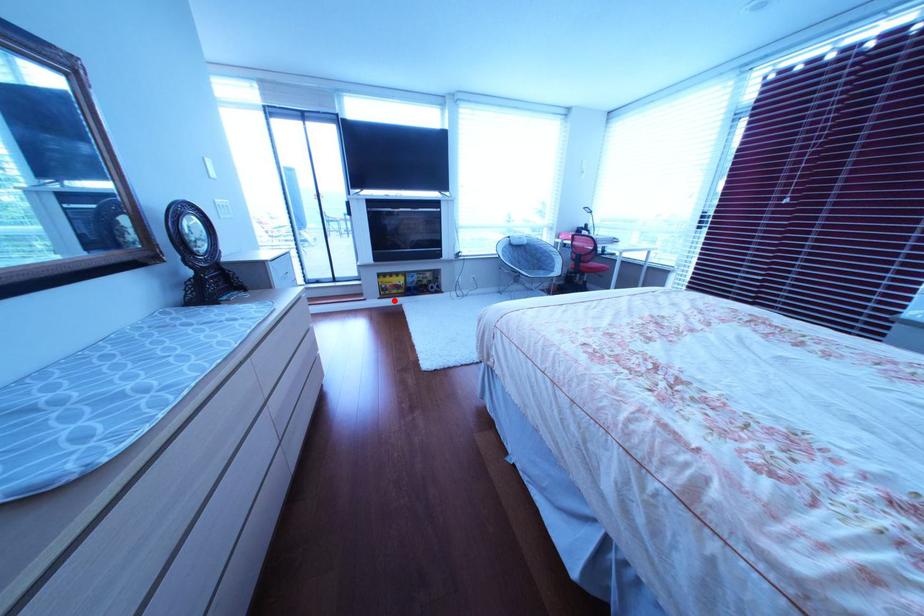
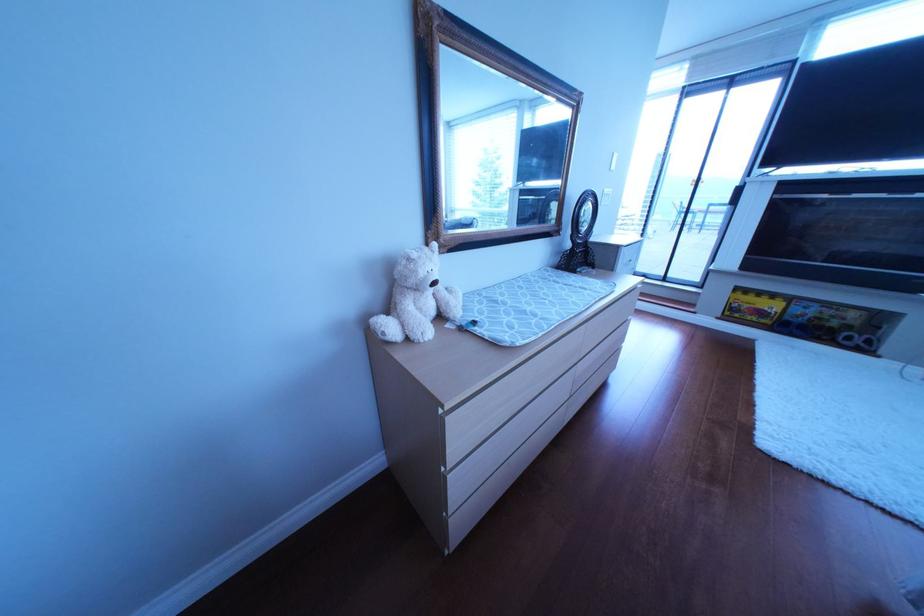
Question: I am providing you with two images of the same scene from different viewpoints. In image1, a red point is highlighted. Considering the same 3D point in image2, which of the following is correct?

Choices:
 (A) It is closer
 (B) It is farther

Answer: (B)